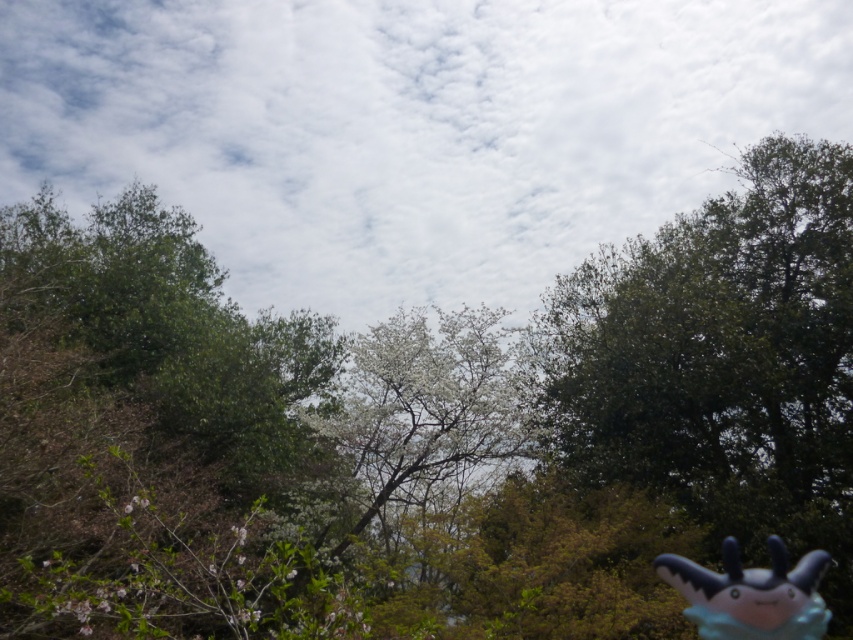
Describe the element at coordinates (409, 129) in the screenshot. Image resolution: width=853 pixels, height=640 pixels. I see `white fluffy cloud at upper center` at that location.

How much distance is there between white fluffy cloud at upper center and white blossoming tree at center?

The distance of white fluffy cloud at upper center from white blossoming tree at center is 23.62 meters.

Is point (505, 291) positioned after point (473, 394)?

Yes, it is.

Where is `white fluffy cloud at upper center`? white fluffy cloud at upper center is located at coordinates (409, 129).

Which is above, green leafy tree at upper left or white blossoming tree at center?

green leafy tree at upper left is higher up.

Does point (144, 387) lie behind point (437, 496)?

No.

Between point (276, 604) and point (486, 426), which one is positioned in front?

Point (276, 604) is more forward.

This screenshot has height=640, width=853. Find the location of `green leafy tree at upper left`. green leafy tree at upper left is located at coordinates (149, 436).

Does white blossoming tree at center have a lesser height compared to blue plush toy at lower right?

No.

Does white blossoming tree at center have a greater height compared to blue plush toy at lower right?

Yes, white blossoming tree at center is taller than blue plush toy at lower right.

You are a GUI agent. You are given a task and a screenshot of the screen. Output one action in this format:
    pyautogui.click(x=<x>, y=<y>)
    Task: Click on the white blossoming tree at center
    This screenshot has width=853, height=640.
    Given the screenshot: What is the action you would take?
    (x=427, y=410)

The image size is (853, 640). Identify the location of white blossoming tree at center. (427, 410).